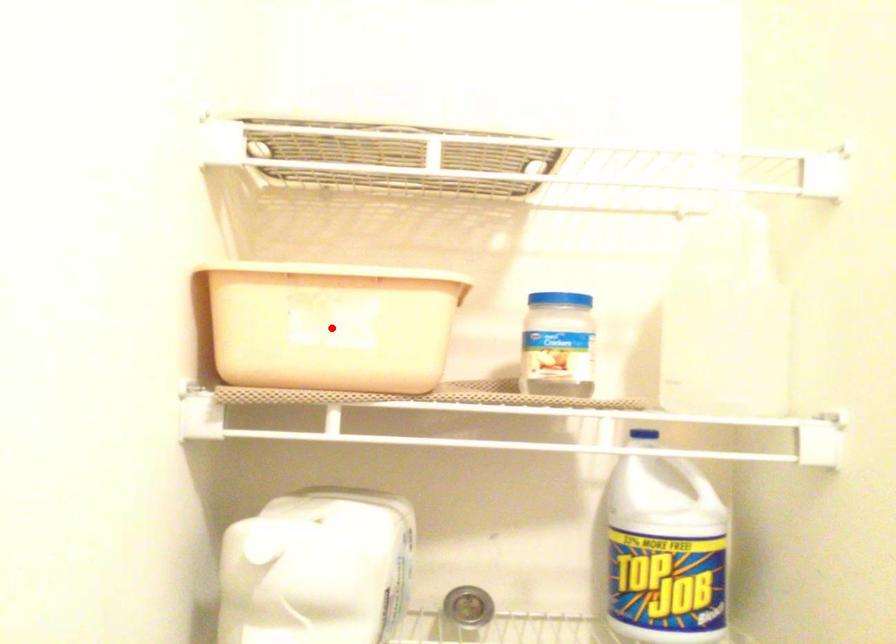
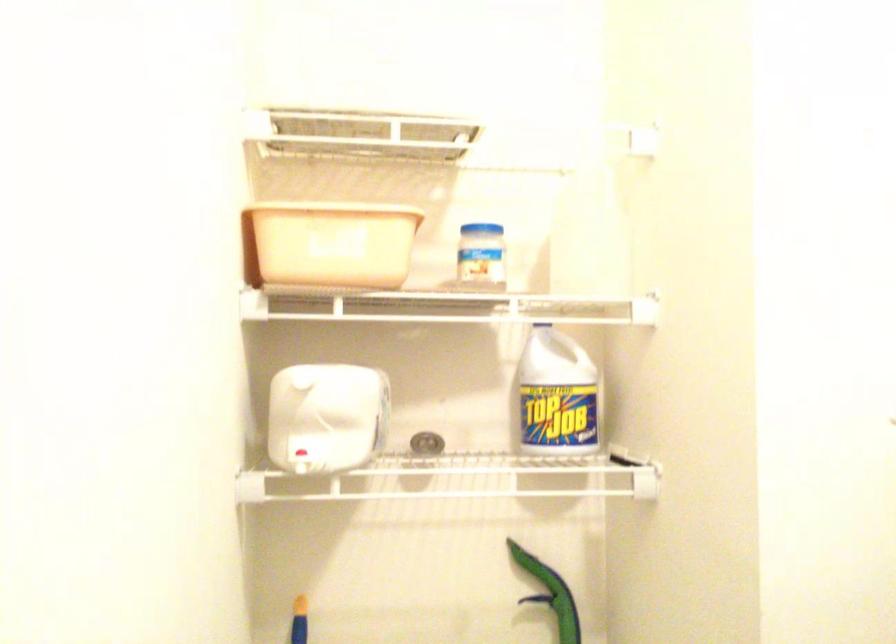
Question: I am providing you with two images of the same scene from different viewpoints. A red point is shown in image1. For the corresponding object point in image2, is it positioned nearer or farther from the camera?

Choices:
 (A) Nearer
 (B) Farther

Answer: (B)